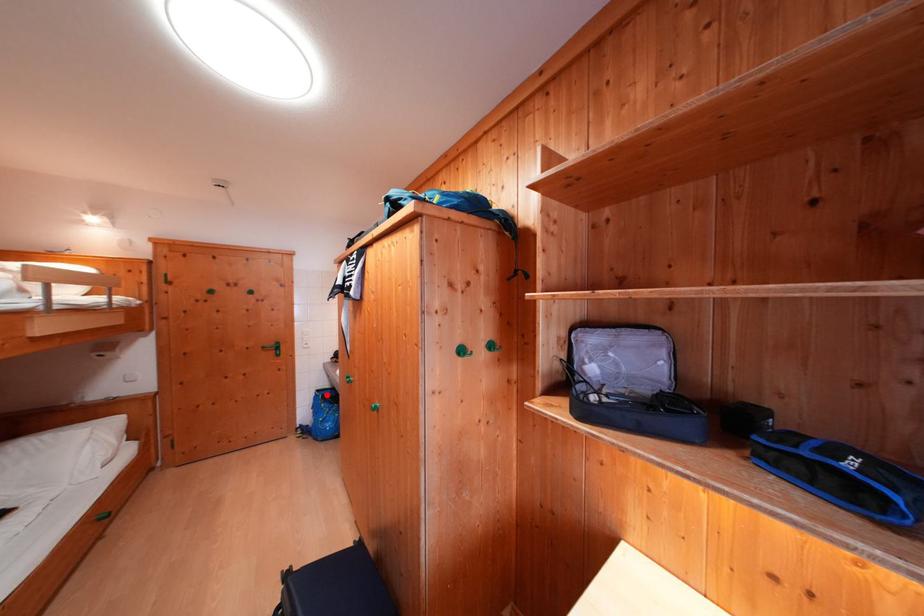
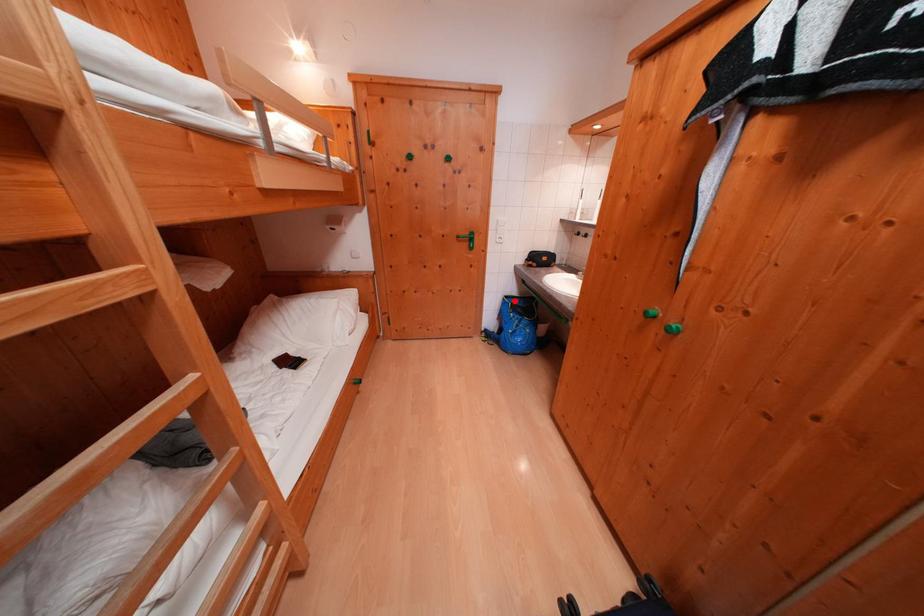
I am providing you with two images of the same scene from different viewpoints. A red point is marked on the first image and another point is marked on the second image. Are the points marked in image1 and image2 representing the same 3D position?

Yes